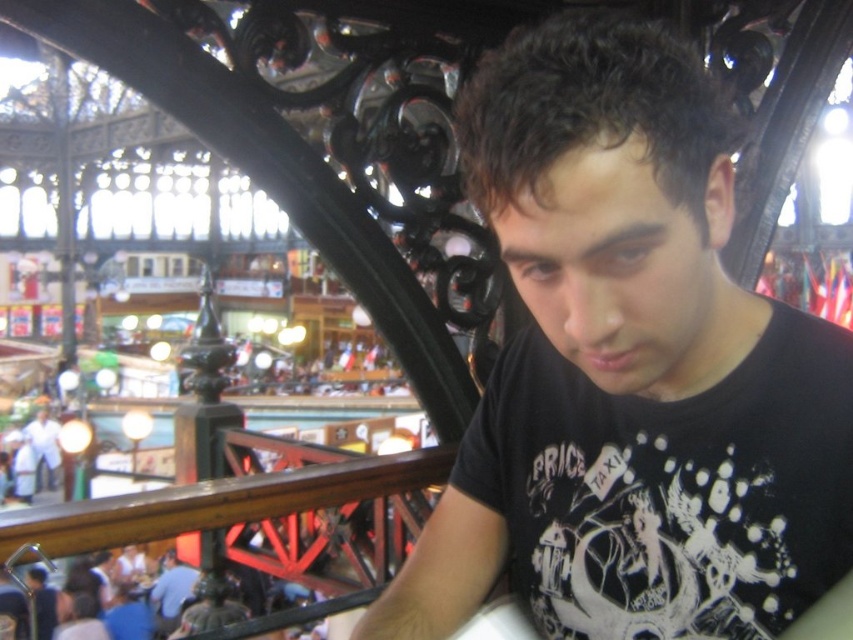
Question: Can you confirm if black matte shirt at center is positioned above blue shirt at lower left?

Choices:
 (A) no
 (B) yes

Answer: (B)

Question: Which object appears closest to the camera in this image?

Choices:
 (A) black matte shirt at center
 (B) white cotton shirt at lower left
 (C) blue shirt at lower left

Answer: (A)

Question: Which object appears closest to the camera in this image?

Choices:
 (A) white cotton shirt at lower left
 (B) black matte shirt at center
 (C) blue shirt at lower left

Answer: (B)

Question: Can you confirm if blue shirt at lower left is wider than white cotton shirt at lower left?

Choices:
 (A) no
 (B) yes

Answer: (A)

Question: Which point appears farthest from the camera in this image?

Choices:
 (A) (165, 596)
 (B) (643, 216)

Answer: (A)

Question: From the image, what is the correct spatial relationship of blue shirt at lower left in relation to white cotton shirt at lower left?

Choices:
 (A) left
 (B) right

Answer: (B)